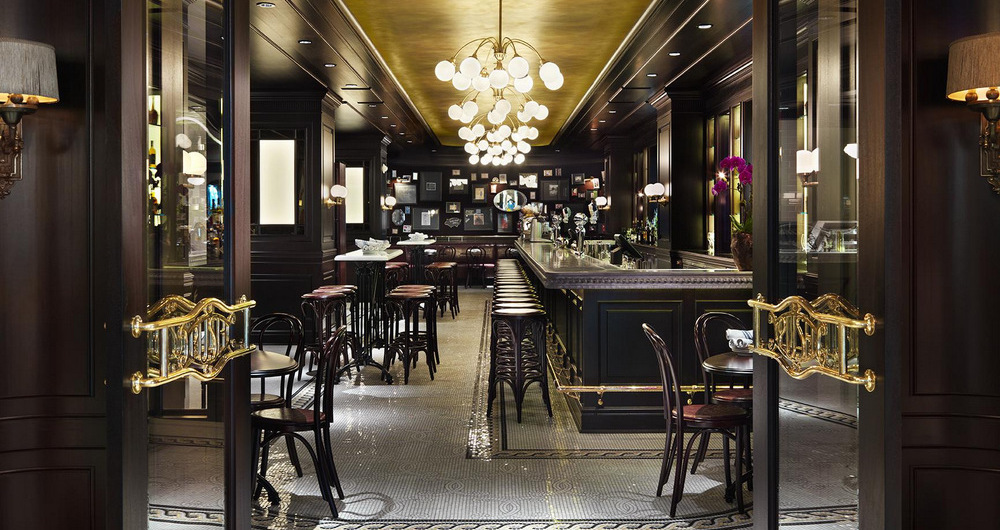
I want to click on lamp pull cords, so click(x=11, y=98), click(x=29, y=100), click(x=976, y=101), click(x=993, y=94).